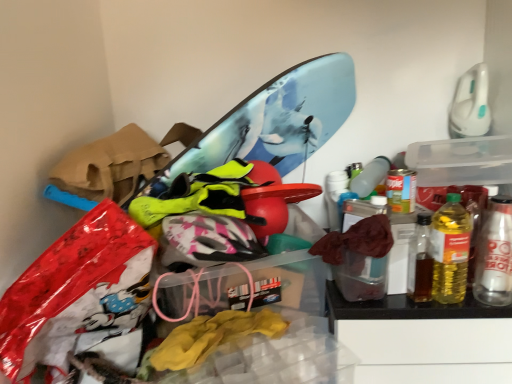
Image resolution: width=512 pixels, height=384 pixels. What do you see at coordinates (495, 255) in the screenshot?
I see `metallic silver can at right, which appears as the 1th bottle when viewed from the right` at bounding box center [495, 255].

The image size is (512, 384). Describe the element at coordinates (450, 250) in the screenshot. I see `translucent plastic bottle at right, the 2th bottle in the right-to-left sequence` at that location.

This screenshot has width=512, height=384. What are the coordinates of `metallic silver can at right, which is the second bottle from left to right` in the screenshot? It's located at (495, 255).

Considering their positions, is transparent plastic storage box at upper right, positioned as the 1th storage box in top-to-bottom order, located in front of or behind metallic silver can at right, which appears as the 1th bottle when viewed from the right?

In the image, transparent plastic storage box at upper right, positioned as the 1th storage box in top-to-bottom order, appears behind metallic silver can at right, which appears as the 1th bottle when viewed from the right.

Looking at this image, measure the distance from transparent plastic storage box at upper right, arranged as the 2th storage box when viewed from the left, to metallic silver can at right, which is the second bottle from left to right.

transparent plastic storage box at upper right, arranged as the 2th storage box when viewed from the left, and metallic silver can at right, which is the second bottle from left to right, are 19.19 centimeters apart.

Between transparent plastic storage box at upper right, arranged as the 2th storage box when viewed from the left, and metallic silver can at right, which appears as the 1th bottle when viewed from the right, which one has less height?

transparent plastic storage box at upper right, arranged as the 2th storage box when viewed from the left, is shorter.

Is transparent plastic storage box at upper right, the second storage box from the bottom, completely or partially outside of metallic silver can at right, which appears as the 1th bottle when viewed from the right?

Yes, transparent plastic storage box at upper right, the second storage box from the bottom, is located beyond the bounds of metallic silver can at right, which appears as the 1th bottle when viewed from the right.

Between transparent plastic storage box at upper right, acting as the 1th storage box starting from the right, and transparent plastic storage box at center, arranged as the first storage box when viewed from the left, which one has more height?

transparent plastic storage box at center, arranged as the first storage box when viewed from the left, is taller.

Is the position of transparent plastic storage box at upper right, positioned as the 1th storage box in top-to-bottom order, less distant than that of transparent plastic storage box at center, placed as the second storage box when sorted from top to bottom?

No, the depth of transparent plastic storage box at upper right, positioned as the 1th storage box in top-to-bottom order, is greater than that of transparent plastic storage box at center, placed as the second storage box when sorted from top to bottom.

Is transparent plastic storage box at center, the first storage box positioned from the bottom, at the back of transparent plastic storage box at upper right, positioned as the 1th storage box in top-to-bottom order?

transparent plastic storage box at upper right, positioned as the 1th storage box in top-to-bottom order, does not have its back to transparent plastic storage box at center, the first storage box positioned from the bottom.

In terms of height, does transparent plastic storage box at upper right, positioned as the 1th storage box in top-to-bottom order, look taller or shorter compared to translucent plastic bottle at right, the 1th bottle viewed from the left?

transparent plastic storage box at upper right, positioned as the 1th storage box in top-to-bottom order, is shorter than translucent plastic bottle at right, the 1th bottle viewed from the left.

Considering their positions, is transparent plastic storage box at upper right, arranged as the 2th storage box when viewed from the left, located in front of or behind translucent plastic bottle at right, the 1th bottle viewed from the left?

Visually, transparent plastic storage box at upper right, arranged as the 2th storage box when viewed from the left, is located behind translucent plastic bottle at right, the 1th bottle viewed from the left.

Considering the points (423, 176) and (440, 224), which point is behind, point (423, 176) or point (440, 224)?

The point (423, 176) is more distant.

The width and height of the screenshot is (512, 384). In the image, there is a translucent plastic bottle at right, the 1th bottle viewed from the left. Identify the location of storage box below it (from the image's perspective). (292, 273).

Does point (300, 213) come farther from viewer compared to point (457, 193)?

Yes.

Considering the relative sizes of transparent plastic storage box at center, the first storage box positioned from the bottom, and translucent plastic bottle at right, the 1th bottle viewed from the left, in the image provided, is transparent plastic storage box at center, the first storage box positioned from the bottom, thinner than translucent plastic bottle at right, the 1th bottle viewed from the left,?

No.

Who is bigger, transparent plastic storage box at center, placed as the second storage box when sorted from top to bottom, or translucent plastic bottle at right, the 1th bottle viewed from the left?

Bigger between the two is transparent plastic storage box at center, placed as the second storage box when sorted from top to bottom.

What's the angular difference between transparent plastic storage box at center, which is the 2th storage box from right to left, and metallic silver can at right, which is the second bottle from left to right,'s facing directions?

The angle between the facing direction of transparent plastic storage box at center, which is the 2th storage box from right to left, and the facing direction of metallic silver can at right, which is the second bottle from left to right, is 8.7 degrees.

Find the location of a particular element. The image size is (512, 384). storage box that appears in front of the metallic silver can at right, which is the second bottle from left to right is located at coordinates (292, 273).

Is transparent plastic storage box at center, arranged as the first storage box when viewed from the left, oriented towards metallic silver can at right, which is the second bottle from left to right?

No, transparent plastic storage box at center, arranged as the first storage box when viewed from the left, is not turned towards metallic silver can at right, which is the second bottle from left to right.

From the image's perspective, is transparent plastic storage box at center, placed as the second storage box when sorted from top to bottom, above or below metallic silver can at right, which appears as the 1th bottle when viewed from the right?

From the image's perspective, transparent plastic storage box at center, placed as the second storage box when sorted from top to bottom, appears below metallic silver can at right, which appears as the 1th bottle when viewed from the right.

Between metallic silver can at right, which appears as the 1th bottle when viewed from the right, and transparent plastic storage box at upper right, the second storage box from the bottom, which one appears on the left side from the viewer's perspective?

From the viewer's perspective, transparent plastic storage box at upper right, the second storage box from the bottom, appears more on the left side.

Are metallic silver can at right, which is the second bottle from left to right, and transparent plastic storage box at upper right, arranged as the 2th storage box when viewed from the left, making contact?

No, metallic silver can at right, which is the second bottle from left to right, is not beside transparent plastic storage box at upper right, arranged as the 2th storage box when viewed from the left.

Can transparent plastic storage box at upper right, acting as the 1th storage box starting from the right, be found inside metallic silver can at right, which is the second bottle from left to right?

Definitely not — transparent plastic storage box at upper right, acting as the 1th storage box starting from the right, is not inside metallic silver can at right, which is the second bottle from left to right.

Does metallic silver can at right, which is the second bottle from left to right, have a greater width compared to transparent plastic storage box at upper right, acting as the 1th storage box starting from the right?

In fact, metallic silver can at right, which is the second bottle from left to right, might be narrower than transparent plastic storage box at upper right, acting as the 1th storage box starting from the right.

Between metallic silver can at right, which is the second bottle from left to right, and transparent plastic storage box at center, which is the 2th storage box from right to left, which one has less height?

metallic silver can at right, which is the second bottle from left to right.

Can you confirm if metallic silver can at right, which is the second bottle from left to right, is positioned to the left of transparent plastic storage box at center, the first storage box positioned from the bottom?

No.

Is metallic silver can at right, which appears as the 1th bottle when viewed from the right, directly adjacent to transparent plastic storage box at center, arranged as the first storage box when viewed from the left?

No, metallic silver can at right, which appears as the 1th bottle when viewed from the right, is not beside transparent plastic storage box at center, arranged as the first storage box when viewed from the left.

From the image's perspective, which bottle is the 1st one below the transparent plastic storage box at upper right, arranged as the 2th storage box when viewed from the left? Please provide its 2D coordinates.

[(495, 255)]

At what (x,y) coordinates should I click in order to perform the action: click on storage box that is above the transparent plastic storage box at center, the first storage box positioned from the bottom (from a real-world perspective). Please return your answer as a coordinate pair (x, y). The height and width of the screenshot is (384, 512). Looking at the image, I should click on (x=458, y=166).

Considering their positions, is translucent plastic bottle at right, the 2th bottle in the right-to-left sequence, positioned closer to transparent plastic storage box at center, arranged as the first storage box when viewed from the left, than metallic silver can at right, which appears as the 1th bottle when viewed from the right?

translucent plastic bottle at right, the 2th bottle in the right-to-left sequence, is positioned closer to the anchor transparent plastic storage box at center, arranged as the first storage box when viewed from the left.

Which object lies nearer to the anchor point transparent plastic storage box at upper right, arranged as the 2th storage box when viewed from the left, metallic silver can at right, which appears as the 1th bottle when viewed from the right, or translucent plastic bottle at right, the 1th bottle viewed from the left?

The object closer to transparent plastic storage box at upper right, arranged as the 2th storage box when viewed from the left, is translucent plastic bottle at right, the 1th bottle viewed from the left.

Considering their positions, is transparent plastic storage box at upper right, the second storage box from the bottom, positioned further to metallic silver can at right, which is the second bottle from left to right, than translucent plastic bottle at right, the 1th bottle viewed from the left?

Among the two, transparent plastic storage box at upper right, the second storage box from the bottom, is located further to metallic silver can at right, which is the second bottle from left to right.

Estimate the real-world distances between objects in this image. Which object is closer to metallic silver can at right, which is the second bottle from left to right, translucent plastic bottle at right, the 1th bottle viewed from the left, or transparent plastic storage box at upper right, the second storage box from the bottom?

The object closer to metallic silver can at right, which is the second bottle from left to right, is translucent plastic bottle at right, the 1th bottle viewed from the left.

Looking at the image, which one is located closer to transparent plastic storage box at upper right, positioned as the 1th storage box in top-to-bottom order, translucent plastic bottle at right, the 2th bottle in the right-to-left sequence, or metallic silver can at right, which is the second bottle from left to right?

translucent plastic bottle at right, the 2th bottle in the right-to-left sequence, is closer to transparent plastic storage box at upper right, positioned as the 1th storage box in top-to-bottom order.

Consider the image. Based on their spatial positions, is transparent plastic storage box at center, which is the 2th storage box from right to left, or transparent plastic storage box at upper right, the second storage box from the bottom, closer to translucent plastic bottle at right, the 1th bottle viewed from the left?

The object closer to translucent plastic bottle at right, the 1th bottle viewed from the left, is transparent plastic storage box at upper right, the second storage box from the bottom.

From the picture: Considering their positions, is transparent plastic storage box at center, the first storage box positioned from the bottom, positioned further to metallic silver can at right, which is the second bottle from left to right, than transparent plastic storage box at upper right, the second storage box from the bottom?

transparent plastic storage box at center, the first storage box positioned from the bottom, is positioned further to the anchor metallic silver can at right, which is the second bottle from left to right.

Considering their positions, is transparent plastic storage box at center, the first storage box positioned from the bottom, positioned further to transparent plastic storage box at upper right, the second storage box from the bottom, than translucent plastic bottle at right, the 1th bottle viewed from the left?

Based on the image, transparent plastic storage box at center, the first storage box positioned from the bottom, appears to be further to transparent plastic storage box at upper right, the second storage box from the bottom.

Locate an element on the screen. bottle between transparent plastic storage box at upper right, the second storage box from the bottom, and translucent plastic bottle at right, the 2th bottle in the right-to-left sequence, in the up-down direction is located at coordinates (495, 255).

Identify the location of storage box between transparent plastic storage box at center, the first storage box positioned from the bottom, and metallic silver can at right, which is the second bottle from left to right, from left to right. Image resolution: width=512 pixels, height=384 pixels. (458, 166).

Where is `bottle situated between transparent plastic storage box at center, placed as the second storage box when sorted from top to bottom, and metallic silver can at right, which appears as the 1th bottle when viewed from the right, from left to right`? The width and height of the screenshot is (512, 384). bottle situated between transparent plastic storage box at center, placed as the second storage box when sorted from top to bottom, and metallic silver can at right, which appears as the 1th bottle when viewed from the right, from left to right is located at coordinates (450, 250).

You are a GUI agent. You are given a task and a screenshot of the screen. Output one action in this format:
    pyautogui.click(x=<x>, y=<y>)
    Task: Click on the bottle between transparent plastic storage box at center, which is the 2th storage box from right to left, and transparent plastic storage box at upper right, positioned as the 1th storage box in top-to-bottom order
    
    Given the screenshot: What is the action you would take?
    coord(450,250)